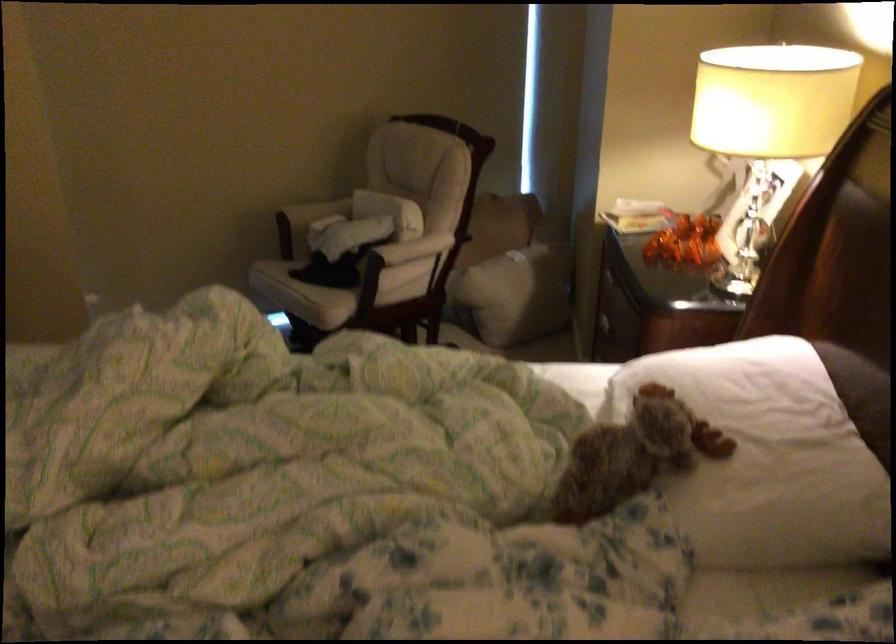
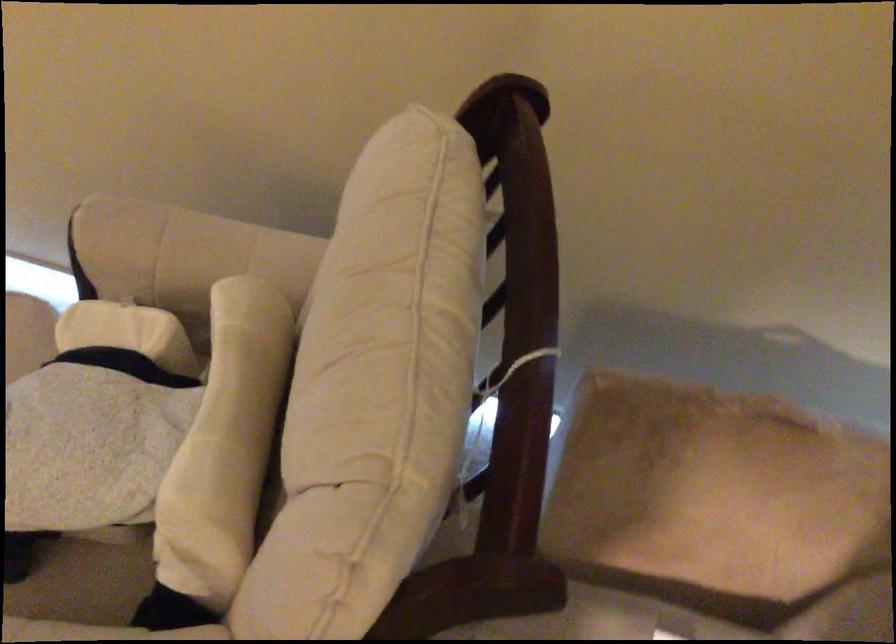
The point at (x=501, y=257) is marked in the first image. Where is the corresponding point in the second image?

(604, 621)